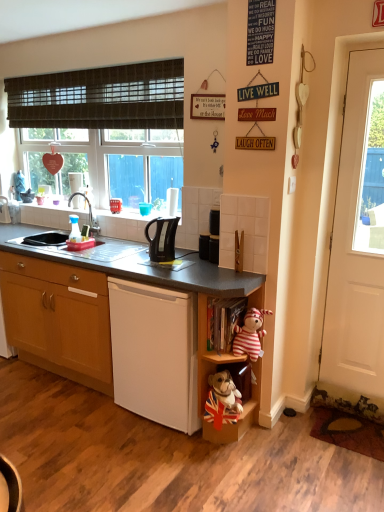
Measure the distance between point [155,373] and camera.

A distance of 7.87 feet exists between point [155,373] and camera.

Locate an element on the screen. white matte dishwasher at center is located at coordinates (155, 353).

In order to face striped fabric stuffed animal at lower right, should I rotate leftwards or rightwards?

You should look right and rotate roughly 8.427 degrees.

Measure the distance between wooden bookshelf at lower center, which ranks as the first shelf in top-to-bottom order, and camera.

wooden bookshelf at lower center, which ranks as the first shelf in top-to-bottom order, is 7.13 feet away from camera.

What is the approximate height of black plastic kettle at center?

6.19 inches.

I want to click on black plastic kettle at center, so click(204, 246).

Find the location of a particular element. The width and height of the screenshot is (384, 512). black plastic kettle at center is located at coordinates (162, 239).

In terms of size, does black plastic kettle at center appear bigger or smaller than brown woven curtain at upper left?

Clearly, black plastic kettle at center is smaller in size than brown woven curtain at upper left.

Is black plastic kettle at center wider or thinner than brown woven curtain at upper left?

Considering their sizes, black plastic kettle at center looks broader than brown woven curtain at upper left.

How different are the orientations of black plastic kettle at center and brown woven curtain at upper left in degrees?

The angle between the facing direction of black plastic kettle at center and the facing direction of brown woven curtain at upper left is 1.1 degrees.

Which is behind, point (172, 251) or point (78, 116)?

Positioned behind is point (78, 116).

Considering the sizes of objects striped fabric stuffed animal at lower right and brown woven curtain at upper left in the image provided, who is smaller, striped fabric stuffed animal at lower right or brown woven curtain at upper left?

With smaller size is striped fabric stuffed animal at lower right.

Is striped fabric stuffed animal at lower right looking in the opposite direction of brown woven curtain at upper left?

No, striped fabric stuffed animal at lower right is not facing away from brown woven curtain at upper left.

Can you tell me how much striped fabric stuffed animal at lower right and brown woven curtain at upper left differ in facing direction?

The angular difference between striped fabric stuffed animal at lower right and brown woven curtain at upper left is 3.92 degrees.

Is wooden cabinet at lower left completely or partially inside black plastic kettle at center?

No, wooden cabinet at lower left is not surrounded by black plastic kettle at center.

Consider the image. Who is taller, black plastic kettle at center or wooden cabinet at lower left?

wooden cabinet at lower left.

From the image's perspective, is black plastic kettle at center below wooden cabinet at lower left?

No.

What's the angular difference between black plastic kettle at center and wooden cabinet at lower left's facing directions?

The facing directions of black plastic kettle at center and wooden cabinet at lower left are 24.4 degrees apart.

Which is more to the right, brown woven curtain at upper left or white matte dishwasher at center?

white matte dishwasher at center.

Can you tell me how much brown woven curtain at upper left and white matte dishwasher at center differ in facing direction?

1.1 degrees separate the facing orientations of brown woven curtain at upper left and white matte dishwasher at center.

Who is smaller, brown woven curtain at upper left or white matte dishwasher at center?

brown woven curtain at upper left is smaller.

From a real-world perspective, is brown woven curtain at upper left physically located above or below white matte dishwasher at center?

brown woven curtain at upper left is above white matte dishwasher at center.

In the scene shown: Is white matte dishwasher at center directly adjacent to wooden cabinet at lower left?

No.

From the image's perspective, is white matte dishwasher at center above or below wooden cabinet at lower left?

From the image's perspective, white matte dishwasher at center appears below wooden cabinet at lower left.

How many degrees apart are the facing directions of white matte dishwasher at center and wooden cabinet at lower left?

There is a 0.254-degree angle between the facing directions of white matte dishwasher at center and wooden cabinet at lower left.

Considering the sizes of objects white matte dishwasher at center and wooden cabinet at lower left in the image provided, who is bigger, white matte dishwasher at center or wooden cabinet at lower left?

wooden cabinet at lower left.

Considering the relative positions of striped fabric stuffed animal at lower right and black plastic kettle at center in the image provided, is striped fabric stuffed animal at lower right to the left or to the right of black plastic kettle at center?

striped fabric stuffed animal at lower right is to the right of black plastic kettle at center.

From the image's perspective, does striped fabric stuffed animal at lower right appear lower than black plastic kettle at center?

Yes, from the image's perspective, striped fabric stuffed animal at lower right is beneath black plastic kettle at center.

Is striped fabric stuffed animal at lower right bigger than black plastic kettle at center?

Indeed, striped fabric stuffed animal at lower right has a larger size compared to black plastic kettle at center.

Would you say striped fabric stuffed animal at lower right contains black plastic kettle at center?

No, striped fabric stuffed animal at lower right does not contain black plastic kettle at center.

In the image, is striped fabric stuffed animal at lower right positioned in front of or behind brushed metal faucet at upper left?

In the image, striped fabric stuffed animal at lower right appears in front of brushed metal faucet at upper left.

Is striped fabric stuffed animal at lower right located outside brushed metal faucet at upper left?

Indeed, striped fabric stuffed animal at lower right is completely outside brushed metal faucet at upper left.

Where is `curtain located on the left of black plastic kettle at center`? curtain located on the left of black plastic kettle at center is located at coordinates (100, 98).

Find the location of a particular element. The height and width of the screenshot is (512, 384). curtain lying behind the striped fabric stuffed animal at lower right is located at coordinates (100, 98).

When comparing their distances from brushed metal faucet at upper left, does brown woven curtain at upper left or white wooden door at right seem closer?

Based on the image, brown woven curtain at upper left appears to be nearer to brushed metal faucet at upper left.

In the scene shown: Which object lies nearer to the anchor point striped fabric stuffed animal at lower right, brown woven curtain at upper left or black plastic kettle at center?

Among the two, black plastic kettle at center is located nearer to striped fabric stuffed animal at lower right.

Which object lies nearer to the anchor point striped fabric stuffed animal at lower right, brown woven curtain at upper left or wooden bookshelf at lower center, acting as the 1th shelf starting from the bottom?

wooden bookshelf at lower center, acting as the 1th shelf starting from the bottom, is closer to striped fabric stuffed animal at lower right.

Which object lies nearer to the anchor point wooden bookshelf at lower center, acting as the 1th shelf starting from the bottom, striped fabric stuffed animal at lower right or wooden cabinet at lower left?

The object closer to wooden bookshelf at lower center, acting as the 1th shelf starting from the bottom, is striped fabric stuffed animal at lower right.

Considering their positions, is brown woven curtain at upper left positioned closer to wooden cabinet at lower left than white wooden door at right?

brown woven curtain at upper left lies closer to wooden cabinet at lower left than the other object.

When comparing their distances from brown woven curtain at upper left, does wooden bookshelf at lower center, which ranks as the first shelf in top-to-bottom order, or wooden bookshelf at lower center, acting as the second shelf starting from the top, seem closer?

Based on the image, wooden bookshelf at lower center, acting as the second shelf starting from the top, appears to be nearer to brown woven curtain at upper left.

From the image, which object appears to be nearer to brushed metal faucet at upper left, wooden bookshelf at lower center, positioned as the second shelf in bottom-to-top order, or wooden cabinet at lower left?

Based on the image, wooden cabinet at lower left appears to be nearer to brushed metal faucet at upper left.

Considering their positions, is white matte dishwasher at center positioned closer to brushed metal faucet at upper left than black plastic kettle at center?

black plastic kettle at center is closer to brushed metal faucet at upper left.

This screenshot has width=384, height=512. What are the coordinates of `toy situated between black plastic kettle at center and white wooden door at right from left to right` in the screenshot? It's located at (250, 334).

What are the coordinates of `tap between brown woven curtain at upper left and wooden bookshelf at lower center, acting as the second shelf starting from the top, vertically` in the screenshot? It's located at (89, 214).

Image resolution: width=384 pixels, height=512 pixels. I want to click on appliance that lies between brown woven curtain at upper left and wooden bookshelf at lower center, which ranks as the first shelf in top-to-bottom order, from top to bottom, so click(x=204, y=246).

The width and height of the screenshot is (384, 512). I want to click on toy between brown woven curtain at upper left and white matte dishwasher at center in the vertical direction, so click(250, 334).